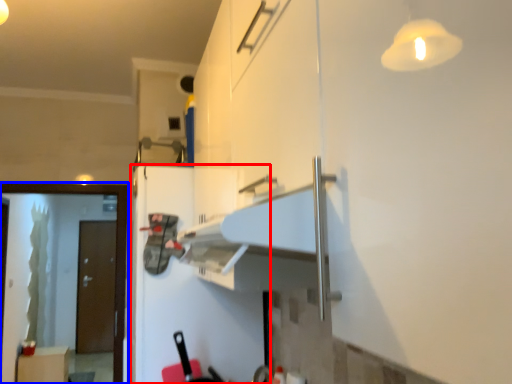
Question: Which of the following is the farthest to the observer, fridge (highlighted by a red box) or screen door (highlighted by a blue box)?

Choices:
 (A) fridge
 (B) screen door

Answer: (B)